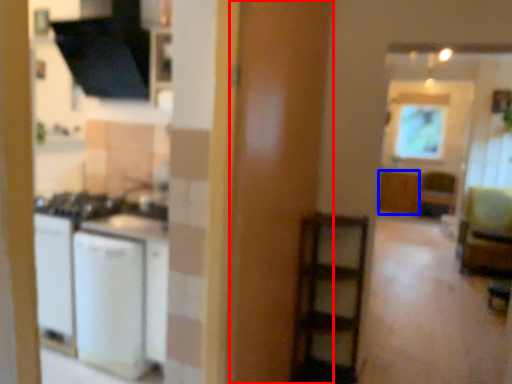
Question: Which object is closer to the camera taking this photo, screen door (highlighted by a red box) or cabinetry (highlighted by a blue box)?

Choices:
 (A) screen door
 (B) cabinetry

Answer: (A)